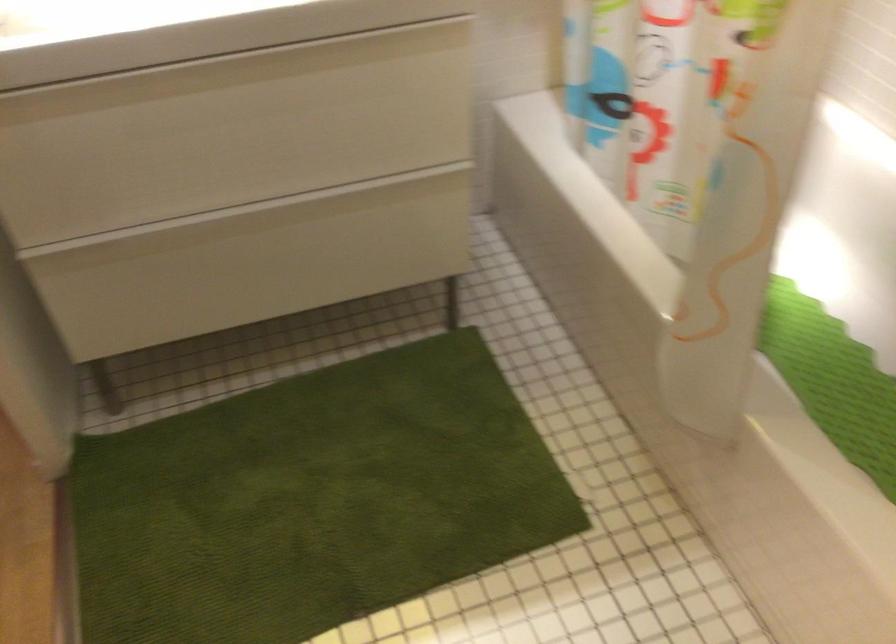
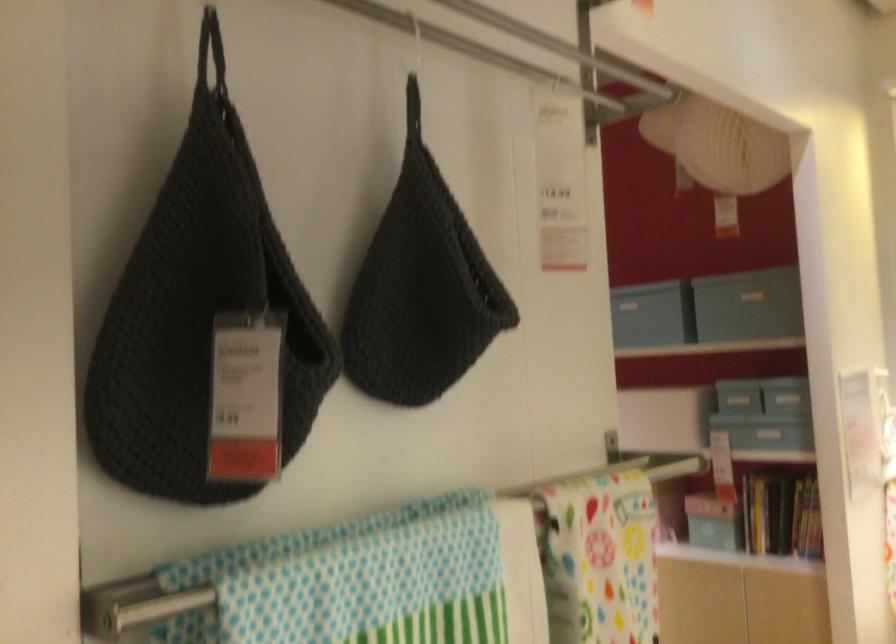
Based on the continuous images, in which direction is the camera rotating?

The rotation direction of the camera is left-up.